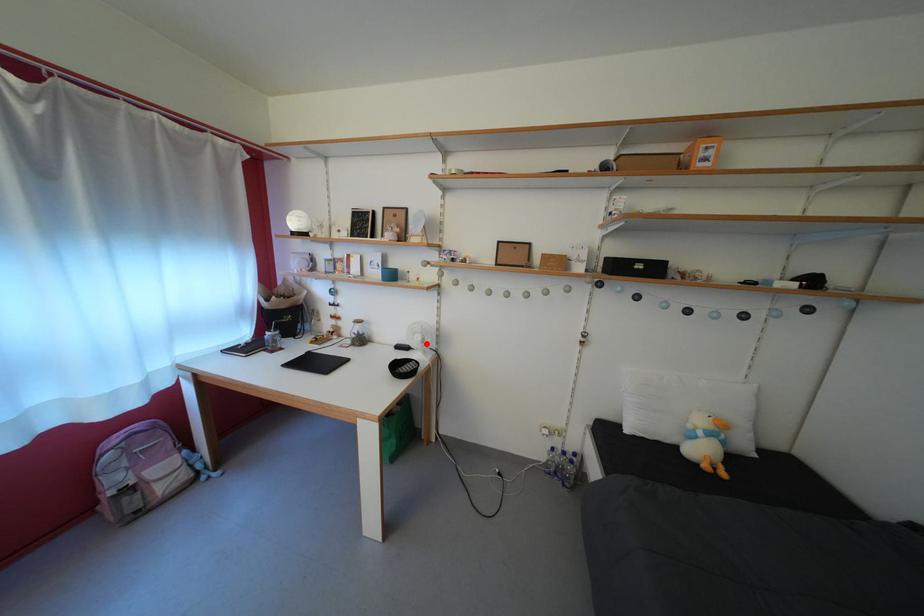
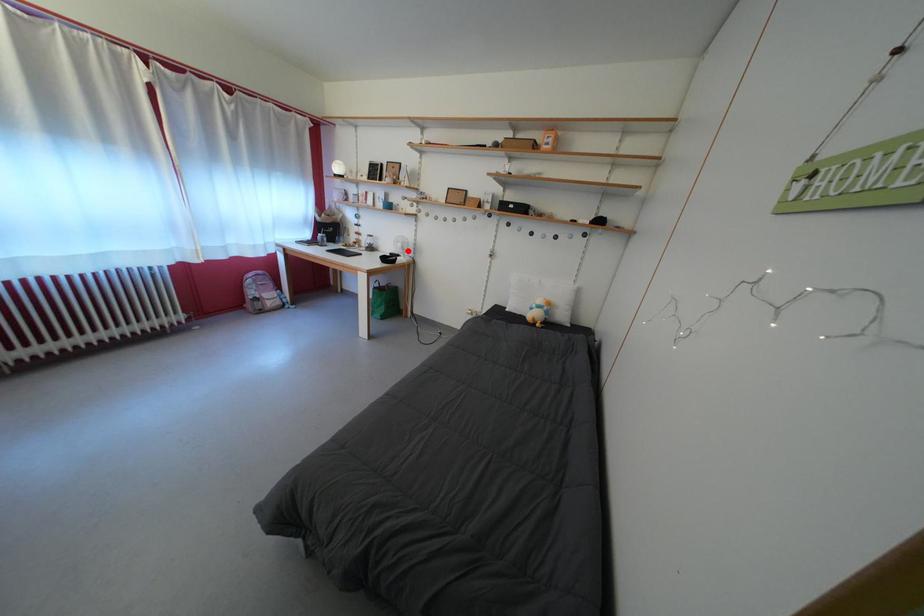
I am providing you with two images of the same scene from different viewpoints. A red point is marked on the first image and another point is marked on the second image. Is the marked point in image1 the same physical position as the marked point in image2?

Yes